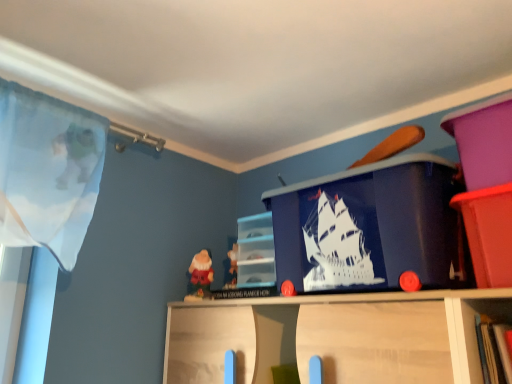
Question: Are matte plastic cabinet at center, which is the 2th cabinet in front-to-back order, and matte plastic bin at upper right, acting as the second cabinet starting from the left, beside each other?

Choices:
 (A) yes
 (B) no

Answer: (B)

Question: Does matte plastic cabinet at center, placed as the first cabinet when sorted from left to right, have a greater width compared to matte plastic bin at upper right, acting as the second cabinet starting from the left?

Choices:
 (A) no
 (B) yes

Answer: (A)

Question: Is matte plastic cabinet at center, the second cabinet positioned from the right, smaller than matte plastic bin at upper right, which ranks as the 2th cabinet in back-to-front order?

Choices:
 (A) yes
 (B) no

Answer: (A)

Question: Does matte plastic cabinet at center, the 1th cabinet viewed from the back, turn towards matte plastic bin at upper right, acting as the second cabinet starting from the left?

Choices:
 (A) yes
 (B) no

Answer: (B)

Question: Is matte plastic cabinet at center, placed as the first cabinet when sorted from left to right, not close to matte plastic bin at upper right, acting as the second cabinet starting from the left?

Choices:
 (A) yes
 (B) no

Answer: (B)

Question: Looking at their shapes, would you say matte plastic cabinet at center, the 1th cabinet viewed from the back, is wider or thinner than blue plastic ship at center?

Choices:
 (A) thin
 (B) wide

Answer: (A)

Question: Relative to blue plastic ship at center, is matte plastic cabinet at center, placed as the first cabinet when sorted from left to right, in front or behind?

Choices:
 (A) front
 (B) behind

Answer: (B)

Question: From a real-world perspective, is matte plastic cabinet at center, the 1th cabinet viewed from the back, above or below blue plastic ship at center?

Choices:
 (A) above
 (B) below

Answer: (B)

Question: Is matte plastic cabinet at center, the second cabinet positioned from the right, spatially inside blue plastic ship at center, or outside of it?

Choices:
 (A) outside
 (B) inside

Answer: (A)

Question: Is matte plastic cabinet at center, the second cabinet positioned from the right, to the left or to the right of matte plastic bin at upper right, which is counted as the first cabinet, starting from the front, in the image?

Choices:
 (A) right
 (B) left

Answer: (B)

Question: From a real-world perspective, relative to matte plastic bin at upper right, placed as the first cabinet when sorted from right to left, is matte plastic cabinet at center, placed as the first cabinet when sorted from left to right, vertically above or below?

Choices:
 (A) above
 (B) below

Answer: (A)

Question: Is matte plastic cabinet at center, placed as the first cabinet when sorted from left to right, in front of or behind matte plastic bin at upper right, placed as the first cabinet when sorted from right to left, in the image?

Choices:
 (A) front
 (B) behind

Answer: (B)

Question: Considering the positions of point (244, 251) and point (510, 218), is point (244, 251) closer or farther from the camera than point (510, 218)?

Choices:
 (A) farther
 (B) closer

Answer: (A)

Question: Is matte plastic bin at upper right, which is counted as the first cabinet, starting from the front, wider or thinner than blue plastic ship at center?

Choices:
 (A) thin
 (B) wide

Answer: (B)

Question: In the image, is matte plastic bin at upper right, placed as the first cabinet when sorted from right to left, on the left side or the right side of blue plastic ship at center?

Choices:
 (A) right
 (B) left

Answer: (A)